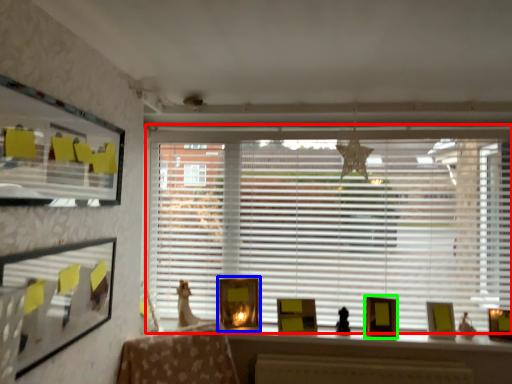
Question: Which is farther away from window blind (highlighted by a red box)? picture frame (highlighted by a blue box) or picture frame (highlighted by a green box)?

Choices:
 (A) picture frame
 (B) picture frame

Answer: (B)